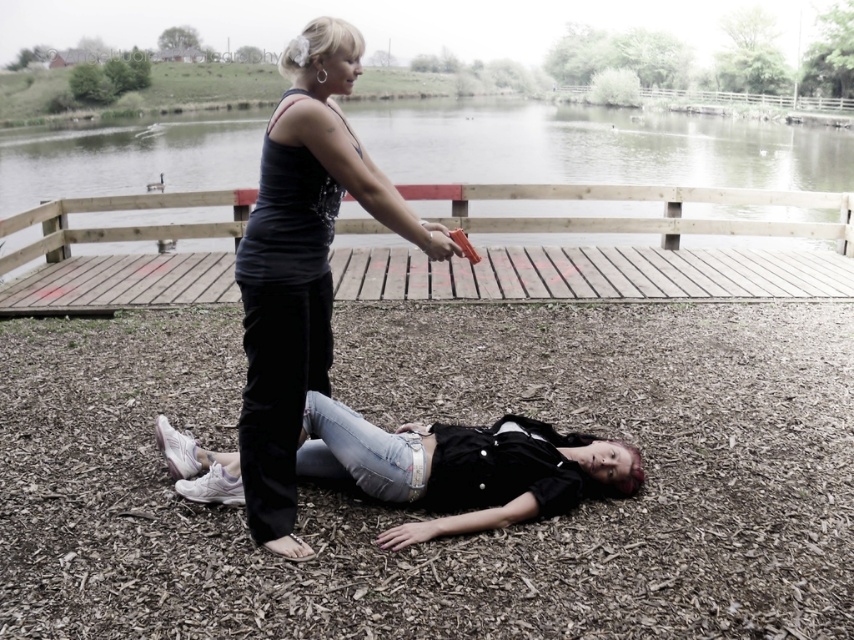
You are standing 2 meters away from the edge of the wooden deck. You see the matte black tank top at center in the scene. Can you safely walk towards it without stepping onto the deck?

The matte black tank top at center is 2.68 meters away from you. Since you are already 2 meters away from the deck edge, you have enough space to walk towards it without stepping onto the deck.